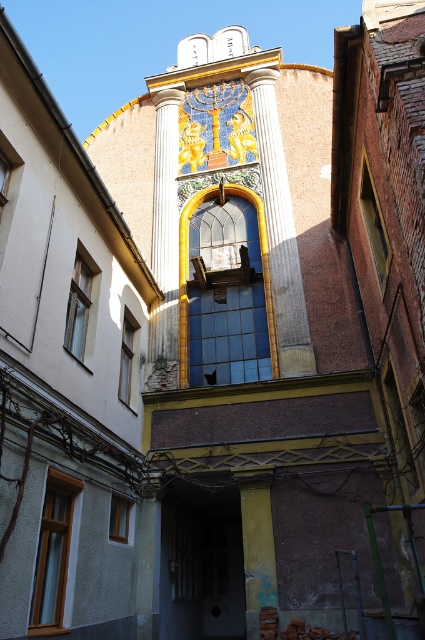
Question: Is white marble column at center to the right of yellow painted wood at center from the viewer's perspective?

Choices:
 (A) no
 (B) yes

Answer: (B)

Question: Is white marble column at center above yellow painted wood at center?

Choices:
 (A) no
 (B) yes

Answer: (B)

Question: Is white marble column at center to the right of yellow painted wood at center from the viewer's perspective?

Choices:
 (A) no
 (B) yes

Answer: (B)

Question: Which of these objects is positioned closest to the gold textured column at center?

Choices:
 (A) yellow painted wood at center
 (B) white marble column at center

Answer: (B)

Question: Which object is the farthest from the white marble column at center?

Choices:
 (A) gold textured column at center
 (B) yellow painted wood at center

Answer: (B)

Question: Which point is closer to the camera taking this photo?

Choices:
 (A) (266, 168)
 (B) (156, 316)

Answer: (B)